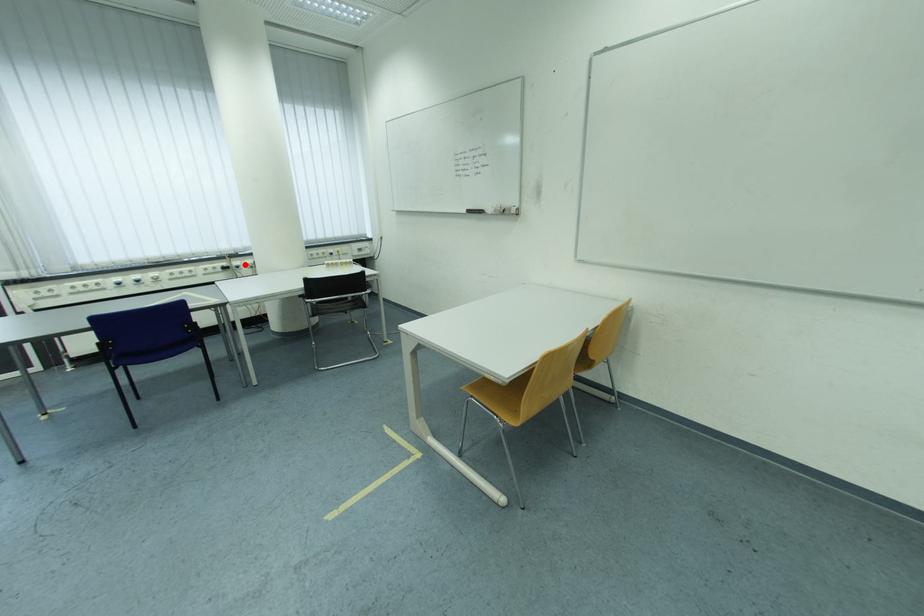
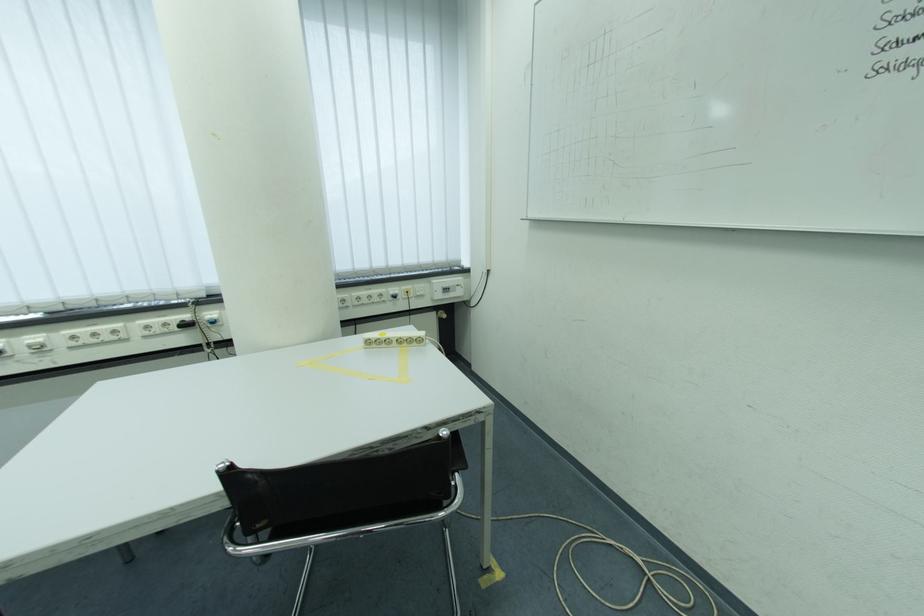
Where in the second image is the point corresponding to the highlighted location from the first image?

(217, 315)